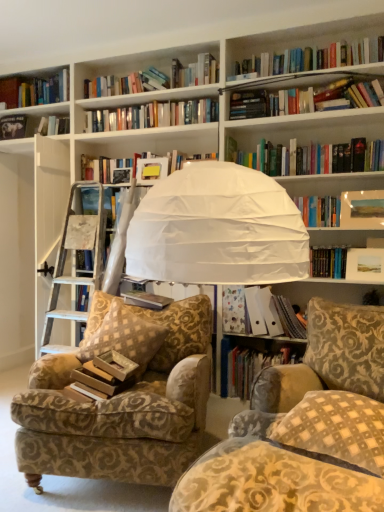
Describe the element at coordinates (271, 314) in the screenshot. I see `matte paper folder at center right, marked as the 2th book in a bottom-to-top arrangement` at that location.

This screenshot has height=512, width=384. What do you see at coordinates (249, 368) in the screenshot? I see `hardcover book at lower center, arranged as the 2th book when viewed from the right` at bounding box center [249, 368].

Where is `checkered fabric pillow at lower right, the first pillow when ordered from front to back`? Image resolution: width=384 pixels, height=512 pixels. checkered fabric pillow at lower right, the first pillow when ordered from front to back is located at coordinates (336, 429).

Measure the distance between checkered fabric pillow at lower right, the second pillow from the left, and camera.

A distance of 4.12 feet exists between checkered fabric pillow at lower right, the second pillow from the left, and camera.

You are a GUI agent. You are given a task and a screenshot of the screen. Output one action in this format:
    pyautogui.click(x=<x>, y=<y>)
    Task: Click on the brown paperback book at center-left
    
    Given the screenshot: What is the action you would take?
    pyautogui.click(x=104, y=376)

This screenshot has width=384, height=512. I want to click on matte paper folder at center right, the 4th book in the left-to-right sequence, so click(271, 314).

Is brown paperback book at center-left spatially inside hardcover book at lower center, arranged as the 2th book when viewed from the right, or outside of it?

brown paperback book at center-left is outside hardcover book at lower center, arranged as the 2th book when viewed from the right.

Is point (90, 367) closer to viewer compared to point (243, 397)?

Yes, point (90, 367) is closer to viewer.

Is brown paperback book at center-left wider than hardcover book at lower center, arranged as the 2th book when viewed from the right?

No, brown paperback book at center-left is not wider than hardcover book at lower center, arranged as the 2th book when viewed from the right.

Is brown paperback book at center-left facing away from hardcover book at lower center, which appears as the fourth book when viewed from the top?

No, brown paperback book at center-left is not facing the opposite direction of hardcover book at lower center, which appears as the fourth book when viewed from the top.

You are a GUI agent. You are given a task and a screenshot of the screen. Output one action in this format:
    pyautogui.click(x=<x>, y=<y>)
    Task: Click on the 1st pillow in front of the matte paper folder at center right, the 3th book viewed from the top, counting from the anchor's position
    Image resolution: width=384 pixels, height=512 pixels.
    Given the screenshot: What is the action you would take?
    pyautogui.click(x=125, y=336)

Is gold-patterned fabric pillow at center-left, the 2th pillow from the right, positioned beyond the bounds of matte paper folder at center right, marked as the 2th book in a bottom-to-top arrangement?

Indeed, gold-patterned fabric pillow at center-left, the 2th pillow from the right, is completely outside matte paper folder at center right, marked as the 2th book in a bottom-to-top arrangement.

Would you consider gold-patterned fabric pillow at center-left, the 2th pillow from the right, to be distant from matte paper folder at center right, the 3th book viewed from the top?

That's not correct — gold-patterned fabric pillow at center-left, the 2th pillow from the right, is a little close to matte paper folder at center right, the 3th book viewed from the top.

Which of these two, hardcover book at center, which is the 3th book in right-to-left order, or brown paperback book at center-left, is wider?

brown paperback book at center-left.

From a real-world perspective, who is located higher, hardcover book at center, the 2th book positioned from the left, or brown paperback book at center-left?

hardcover book at center, the 2th book positioned from the left, from a real-world perspective.

Is hardcover book at center, the third book positioned from the bottom, outside of brown paperback book at center-left?

hardcover book at center, the third book positioned from the bottom, lies outside brown paperback book at center-left's area.

The width and height of the screenshot is (384, 512). I want to click on book that is the 2nd one above the brown paperback book at center-left (from a real-world perspective), so click(x=146, y=298).

Which of these two, brown paperback book at center-left or matte paper folder at center right, marked as the first book in a right-to-left arrangement, is bigger?

matte paper folder at center right, marked as the first book in a right-to-left arrangement.

Can you tell me how much brown paperback book at center-left and matte paper folder at center right, the 3th book viewed from the top, differ in facing direction?

The angle between the facing direction of brown paperback book at center-left and the facing direction of matte paper folder at center right, the 3th book viewed from the top, is 2.63 degrees.

Is brown paperback book at center-left far from matte paper folder at center right, the 3th book viewed from the top?

No, brown paperback book at center-left is not far away from matte paper folder at center right, the 3th book viewed from the top.

Based on the photo, could you tell me if brown paperback book at center-left is facing matte paper folder at center right, marked as the first book in a right-to-left arrangement?

No, brown paperback book at center-left does not turn towards matte paper folder at center right, marked as the first book in a right-to-left arrangement.

Is gold-patterned fabric pillow at center-left, the 1th pillow positioned from the back, looking in the opposite direction of hardcover book at center, which is the second book in top-to-bottom order?

Absolutely, gold-patterned fabric pillow at center-left, the 1th pillow positioned from the back, is directed away from hardcover book at center, which is the second book in top-to-bottom order.

Considering the sizes of objects gold-patterned fabric pillow at center-left, which ranks as the 1th pillow in left-to-right order, and hardcover book at center, which is the 3th book in right-to-left order, in the image provided, who is smaller, gold-patterned fabric pillow at center-left, which ranks as the 1th pillow in left-to-right order, or hardcover book at center, which is the 3th book in right-to-left order,?

hardcover book at center, which is the 3th book in right-to-left order, is smaller.

Considering the relative positions of gold-patterned fabric pillow at center-left, the second pillow in the front-to-back sequence, and hardcover book at center, the third book positioned from the bottom, in the image provided, is gold-patterned fabric pillow at center-left, the second pillow in the front-to-back sequence, to the right of hardcover book at center, the third book positioned from the bottom, from the viewer's perspective?

In fact, gold-patterned fabric pillow at center-left, the second pillow in the front-to-back sequence, is to the left of hardcover book at center, the third book positioned from the bottom.

Considering the sizes of objects gold-patterned fabric pillow at center-left, the 1th pillow positioned from the back, and hardcover book at center, which is the second book in top-to-bottom order, in the image provided, who is taller, gold-patterned fabric pillow at center-left, the 1th pillow positioned from the back, or hardcover book at center, which is the second book in top-to-bottom order,?

gold-patterned fabric pillow at center-left, the 1th pillow positioned from the back, is taller.

Considering the sizes of objects hardcover book at lower center, which appears as the fourth book when viewed from the top, and brown paperback book at center-left in the image provided, who is taller, hardcover book at lower center, which appears as the fourth book when viewed from the top, or brown paperback book at center-left?

hardcover book at lower center, which appears as the fourth book when viewed from the top, is taller.

Does point (245, 375) come closer to viewer compared to point (120, 367)?

No, it is not.

Between hardcover book at lower center, which is the first book from bottom to top, and brown paperback book at center-left, which one has smaller width?

brown paperback book at center-left.

Is hardcover book at lower center, which appears as the fourth book when viewed from the top, to the left of brown paperback book at center-left from the viewer's perspective?

No, hardcover book at lower center, which appears as the fourth book when viewed from the top, is not to the left of brown paperback book at center-left.

Considering the relative positions of gold-patterned fabric pillow at center-left, the 1th pillow positioned from the back, and hardcover book at upper left, which is the fourth book from bottom to top, in the image provided, is gold-patterned fabric pillow at center-left, the 1th pillow positioned from the back, to the left or to the right of hardcover book at upper left, which is the fourth book from bottom to top,?

In the image, gold-patterned fabric pillow at center-left, the 1th pillow positioned from the back, appears on the right side of hardcover book at upper left, which is the fourth book from bottom to top.

What's the angular difference between gold-patterned fabric pillow at center-left, the second pillow in the front-to-back sequence, and hardcover book at upper left, the fourth book when ordered from right to left,'s facing directions?

They differ by 15.7 degrees in their facing directions.

There is a gold-patterned fabric pillow at center-left, the 1th pillow positioned from the back. Where is `the 3rd book above it (from the image's perspective)`? This screenshot has width=384, height=512. the 3rd book above it (from the image's perspective) is located at coordinates (12, 127).

From the image's perspective, which one is positioned lower, gold-patterned fabric pillow at center-left, the 1th pillow positioned from the back, or hardcover book at upper left, the fourth book when ordered from right to left?

gold-patterned fabric pillow at center-left, the 1th pillow positioned from the back.

Identify the location of paperback book above the hardcover book at lower center, which is the third book in left-to-right order (from a real-world perspective). (104, 376).

From the gold-patterned fabric pillow at center-left, which ranks as the 1th pillow in left-to-right order, count 3rd book to the right and point to it. Please provide its 2D coordinates.

[(271, 314)]

Estimate the real-world distances between objects in this image. Which object is further from patterned fabric armchair at left, gold-patterned fabric pillow at center-left, the 2th pillow from the right, or brown paperback book at center-left?

brown paperback book at center-left is positioned further to the anchor patterned fabric armchair at left.

In the scene shown: Which object lies nearer to the anchor point gold-patterned fabric pillow at center-left, which ranks as the 1th pillow in left-to-right order, hardcover book at lower center, which is the first book from bottom to top, or matte paper folder at center right, the 3th book viewed from the top?

matte paper folder at center right, the 3th book viewed from the top, is closer to gold-patterned fabric pillow at center-left, which ranks as the 1th pillow in left-to-right order.

When comparing their distances from brown paperback book at center-left, does hardcover book at center, which is the 3th book in right-to-left order, or matte paper folder at center right, marked as the 2th book in a bottom-to-top arrangement, seem closer?

hardcover book at center, which is the 3th book in right-to-left order, is positioned closer to the anchor brown paperback book at center-left.

From the image, which object appears to be farther from matte paper folder at center right, the 3th book viewed from the top, hardcover book at center, the 2th book positioned from the left, or gold-patterned fabric pillow at center-left, the second pillow in the front-to-back sequence?

gold-patterned fabric pillow at center-left, the second pillow in the front-to-back sequence, is positioned further to the anchor matte paper folder at center right, the 3th book viewed from the top.

Looking at the image, which one is located further to hardcover book at lower center, which is the first book from bottom to top, patterned fabric armchair at left or gold-patterned fabric pillow at center-left, the second pillow in the front-to-back sequence?

Based on the image, patterned fabric armchair at left appears to be further to hardcover book at lower center, which is the first book from bottom to top.

Looking at the image, which one is located closer to hardcover book at lower center, which appears as the fourth book when viewed from the top, hardcover book at center, the 2th book positioned from the left, or hardcover book at upper left, which ranks as the 1th book in top-to-bottom order?

hardcover book at center, the 2th book positioned from the left, is positioned closer to the anchor hardcover book at lower center, which appears as the fourth book when viewed from the top.

When comparing their distances from brown paperback book at center-left, does matte paper folder at center right, marked as the first book in a right-to-left arrangement, or hardcover book at lower center, arranged as the 2th book when viewed from the right, seem closer?

The object closer to brown paperback book at center-left is hardcover book at lower center, arranged as the 2th book when viewed from the right.

When comparing their distances from hardcover book at lower center, which appears as the fourth book when viewed from the top, does matte paper folder at center right, marked as the 2th book in a bottom-to-top arrangement, or gold-patterned fabric pillow at center-left, the 1th pillow positioned from the back, seem further?

gold-patterned fabric pillow at center-left, the 1th pillow positioned from the back, is positioned further to the anchor hardcover book at lower center, which appears as the fourth book when viewed from the top.

Where is `pillow between brown paperback book at center-left and hardcover book at lower center, which is the third book in left-to-right order, from left to right`? The image size is (384, 512). pillow between brown paperback book at center-left and hardcover book at lower center, which is the third book in left-to-right order, from left to right is located at coordinates (125, 336).

You are a GUI agent. You are given a task and a screenshot of the screen. Output one action in this format:
    pyautogui.click(x=<x>, y=<y>)
    Task: Click on the paperback book situated between hardcover book at upper left, which ranks as the 1th book in top-to-bottom order, and matte paper folder at center right, the 4th book in the left-to-right sequence, from left to right
    The image size is (384, 512).
    Given the screenshot: What is the action you would take?
    pyautogui.click(x=104, y=376)

Locate an element on the screen. This screenshot has width=384, height=512. chair between checkered fabric pillow at lower right, the second pillow from the left, and matte paper folder at center right, marked as the 2th book in a bottom-to-top arrangement, in the front-back direction is located at coordinates (122, 403).

Where is `pillow between patterned fabric armchair at left and hardcover book at center, the 2th book positioned from the left, from front to back`? The image size is (384, 512). pillow between patterned fabric armchair at left and hardcover book at center, the 2th book positioned from the left, from front to back is located at coordinates 125,336.